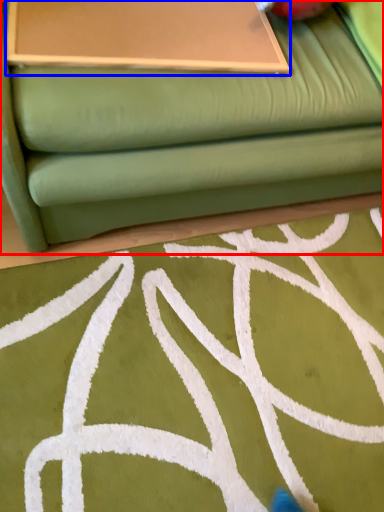
Question: Which object appears closest to the camera in this image, studio couch (highlighted by a red box) or table (highlighted by a blue box)?

Choices:
 (A) studio couch
 (B) table

Answer: (A)